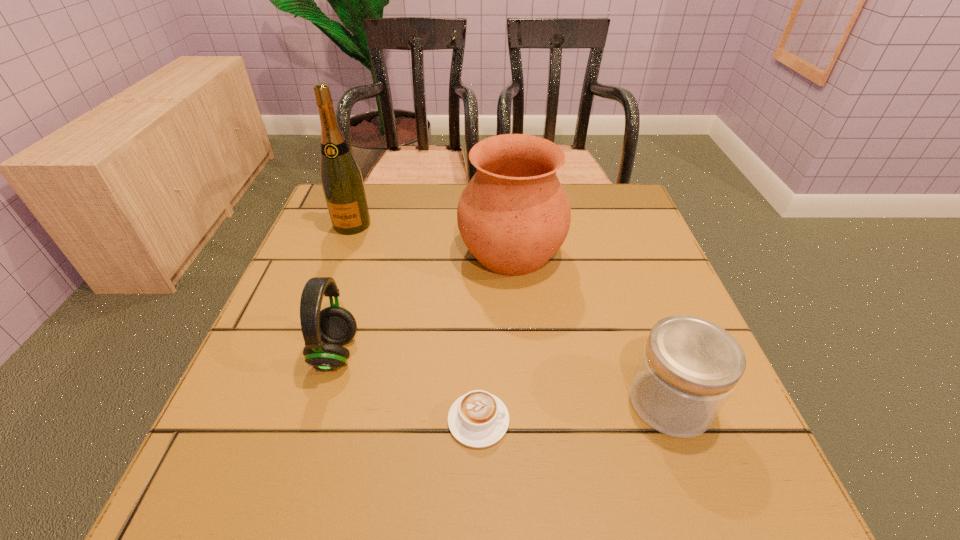
You are a GUI agent. You are given a task and a screenshot of the screen. Output one action in this format:
    pyautogui.click(x=<x>, y=<y>)
    Task: Click on the wine bottle
    This screenshot has width=960, height=540.
    Given the screenshot: What is the action you would take?
    pyautogui.click(x=341, y=178)

Find the location of a particular element. Image resolution: width=960 pixels, height=540 pixels. pottery is located at coordinates (514, 215).

Where is `headset`? headset is located at coordinates (335, 326).

Identify the location of the second shortest object. This screenshot has width=960, height=540. (689, 366).

Identify the location of the rightmost object. Image resolution: width=960 pixels, height=540 pixels. (689, 366).

I want to click on cappuccino, so click(478, 419).

You are a GUI agent. You are given a task and a screenshot of the screen. Output one action in this format:
    pyautogui.click(x=<x>, y=<y>)
    Task: Click on the free space located 0.380m on the front-facing side of the tallest object
    
    Given the screenshot: What is the action you would take?
    pyautogui.click(x=300, y=363)

What are the coordinates of `free location located 0.340m on the front of the pottery` in the screenshot? It's located at (527, 442).

Where is `blank space located on the ear cups of the headset`? blank space located on the ear cups of the headset is located at coordinates (456, 353).

Locate an element on the screen. The image size is (960, 540). vacant space located on the back of the jar is located at coordinates (636, 307).